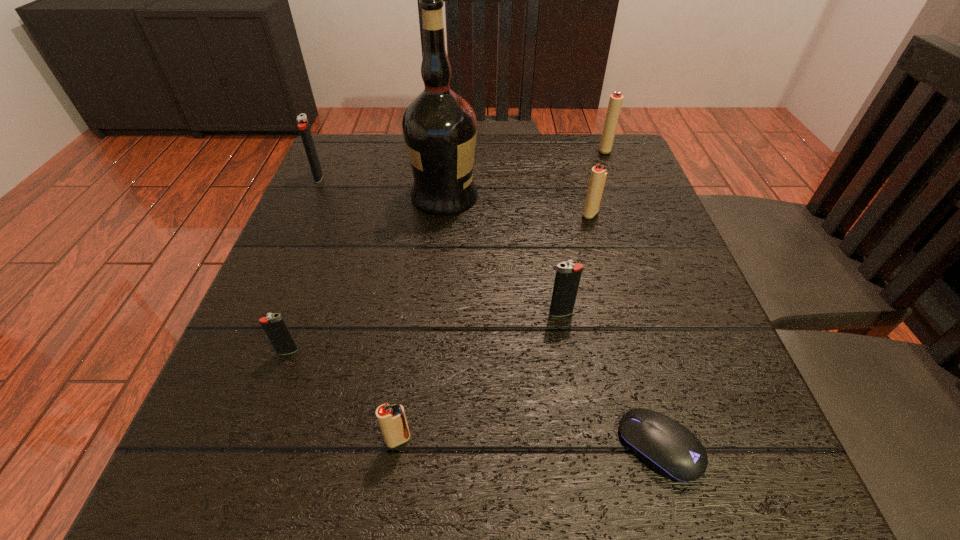
The height and width of the screenshot is (540, 960). In order to click on free space between the second nearest igniter and the liquor in this screenshot , I will do `click(366, 273)`.

This screenshot has width=960, height=540. Identify the location of free space between the computer mouse and the leftmost object. (489, 312).

Where is `free space between the fourth object from right to left and the black computer mouse`? free space between the fourth object from right to left and the black computer mouse is located at coordinates (611, 380).

Identify the location of free space between the second nearest igniter and the nearest igniter. (x=343, y=395).

Identify the location of free point between the leftmost red igniter and the second red igniter from left to right. The width and height of the screenshot is (960, 540). (494, 327).

Locate an element on the screen. Image resolution: width=960 pixels, height=540 pixels. the fifth closest object relative to the second red igniter from right to left is located at coordinates (392, 419).

Find the location of a particular element. The height and width of the screenshot is (540, 960). the sixth closest object to the second igniter from left to right is located at coordinates (598, 175).

Point out which igniter is positioned as the nearest to the second farthest igniter. Please provide its 2D coordinates. Your answer should be formatted as a tuple, i.e. [(x, y)], where the tuple contains the x and y coordinates of a point satisfying the conditions above.

[(274, 326)]

Locate an element on the screen. The height and width of the screenshot is (540, 960). igniter that is the third closest to the shortest object is located at coordinates (598, 175).

Choose which red igniter is the second nearest neighbor to the smallest red igniter. Please provide its 2D coordinates. Your answer should be formatted as a tuple, i.e. [(x, y)], where the tuple contains the x and y coordinates of a point satisfying the conditions above.

[(615, 102)]